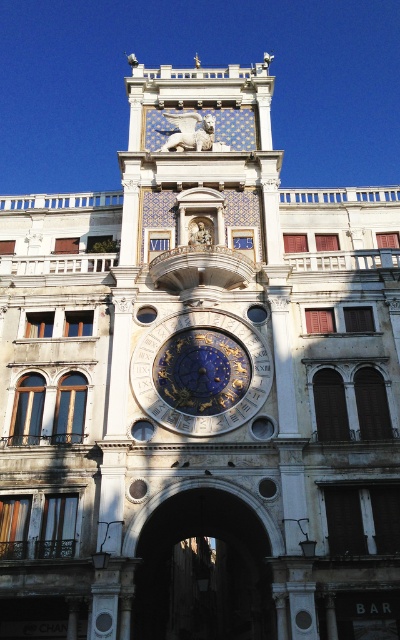
Question: Which point is farther from the camera taking this photo?

Choices:
 (A) (225, 360)
 (B) (158, 529)

Answer: (B)

Question: Is dark stone archway at center to the right of blue metallic clock at center from the viewer's perspective?

Choices:
 (A) yes
 (B) no

Answer: (B)

Question: Does dark stone archway at center appear under blue metallic clock at center?

Choices:
 (A) yes
 (B) no

Answer: (A)

Question: Is dark stone archway at center bigger than blue metallic clock at center?

Choices:
 (A) yes
 (B) no

Answer: (A)

Question: Which object is farther from the camera taking this photo?

Choices:
 (A) dark stone archway at center
 (B) blue metallic clock at center

Answer: (B)